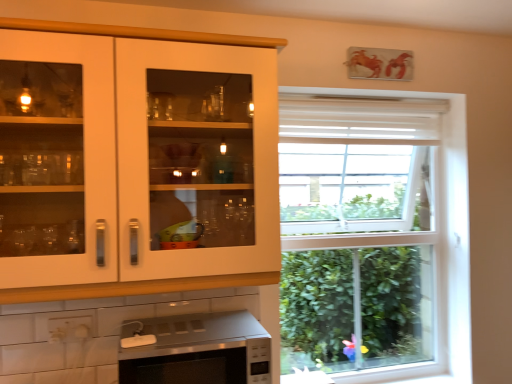
The image size is (512, 384). Describe the element at coordinates (137, 158) in the screenshot. I see `white glossy cabinet at upper left` at that location.

Find the location of a particular element. white glossy cabinet at upper left is located at coordinates (137, 158).

The height and width of the screenshot is (384, 512). Describe the element at coordinates (201, 349) in the screenshot. I see `satin silver microwave at lower center` at that location.

Locate an element on the screen. This screenshot has width=512, height=384. satin silver microwave at lower center is located at coordinates (201, 349).

I want to click on white glossy cabinet at upper left, so click(137, 158).

In the scene shown: Considering the positions of objects white glossy cabinet at upper left and satin silver microwave at lower center in the image provided, who is more to the left, white glossy cabinet at upper left or satin silver microwave at lower center?

white glossy cabinet at upper left is more to the left.

Is the depth of white glossy cabinet at upper left less than that of satin silver microwave at lower center?

Yes, white glossy cabinet at upper left is in front of satin silver microwave at lower center.

Between point (247, 65) and point (195, 331), which one is positioned behind?

The point (247, 65) is farther from the camera.

In the scene shown: From the image's perspective, between white glossy cabinet at upper left and satin silver microwave at lower center, which one is located above?

white glossy cabinet at upper left is shown above in the image.

From a real-world perspective, is white glossy cabinet at upper left positioned under satin silver microwave at lower center based on gravity?

Actually, white glossy cabinet at upper left is physically above satin silver microwave at lower center in the real world.

Is white glossy cabinet at upper left wider than satin silver microwave at lower center?

No.

In terms of height, does white glossy cabinet at upper left look taller or shorter compared to satin silver microwave at lower center?

Considering their sizes, white glossy cabinet at upper left has more height than satin silver microwave at lower center.

Between white glossy cabinet at upper left and satin silver microwave at lower center, which one has larger size?

With larger size is white glossy cabinet at upper left.

Can satin silver microwave at lower center be found inside white glossy cabinet at upper left?

No, satin silver microwave at lower center is not a part of white glossy cabinet at upper left.

Is the surface of white glossy cabinet at upper left in direct contact with satin silver microwave at lower center?

white glossy cabinet at upper left and satin silver microwave at lower center are not in contact.

Is white glossy cabinet at upper left oriented towards satin silver microwave at lower center?

No, white glossy cabinet at upper left is not facing towards satin silver microwave at lower center.

Can you tell me how much white glossy cabinet at upper left and satin silver microwave at lower center differ in facing direction?

The facing directions of white glossy cabinet at upper left and satin silver microwave at lower center are 0.00118 degrees apart.

I want to click on microwave oven located behind the white glossy cabinet at upper left, so [x=201, y=349].

Can you confirm if satin silver microwave at lower center is positioned to the right of white glossy cabinet at upper left?

Correct, you'll find satin silver microwave at lower center to the right of white glossy cabinet at upper left.

Considering the positions of objects satin silver microwave at lower center and white glossy cabinet at upper left in the image provided, who is behind, satin silver microwave at lower center or white glossy cabinet at upper left?

satin silver microwave at lower center is further from the camera.

Between point (241, 370) and point (252, 258), which one is positioned in front?

Positioned in front is point (241, 370).

From the image's perspective, is satin silver microwave at lower center located beneath white glossy cabinet at upper left?

Yes, from the image's perspective, satin silver microwave at lower center is below white glossy cabinet at upper left.

From a real-world perspective, who is located lower, satin silver microwave at lower center or white glossy cabinet at upper left?

In real-world perspective, satin silver microwave at lower center is lower.

Which of these two, satin silver microwave at lower center or white glossy cabinet at upper left, is wider?

Wider between the two is satin silver microwave at lower center.

Is satin silver microwave at lower center taller or shorter than white glossy cabinet at upper left?

Considering their sizes, satin silver microwave at lower center has less height than white glossy cabinet at upper left.

In terms of size, does satin silver microwave at lower center appear bigger or smaller than white glossy cabinet at upper left?

In the image, satin silver microwave at lower center appears to be smaller than white glossy cabinet at upper left.

Is satin silver microwave at lower center inside the boundaries of white glossy cabinet at upper left, or outside?

satin silver microwave at lower center cannot be found inside white glossy cabinet at upper left.

Is satin silver microwave at lower center placed right next to white glossy cabinet at upper left?

No, satin silver microwave at lower center is not touching white glossy cabinet at upper left.

Is satin silver microwave at lower center turned away from white glossy cabinet at upper left?

No, satin silver microwave at lower center's orientation is not away from white glossy cabinet at upper left.

How many degrees apart are the facing directions of satin silver microwave at lower center and white glossy cabinet at upper left?

They differ by 0.00118 degrees in their facing directions.

How much distance is there between satin silver microwave at lower center and white glossy cabinet at upper left?

17.79 inches.

Image resolution: width=512 pixels, height=384 pixels. I want to click on microwave oven directly beneath the white glossy cabinet at upper left (from a real-world perspective), so click(x=201, y=349).

Where is `cabinetry located above the satin silver microwave at lower center (from the image's perspective)`? cabinetry located above the satin silver microwave at lower center (from the image's perspective) is located at coordinates tap(137, 158).

This screenshot has height=384, width=512. What are the coordinates of `cabinetry on the left of satin silver microwave at lower center` in the screenshot? It's located at (137, 158).